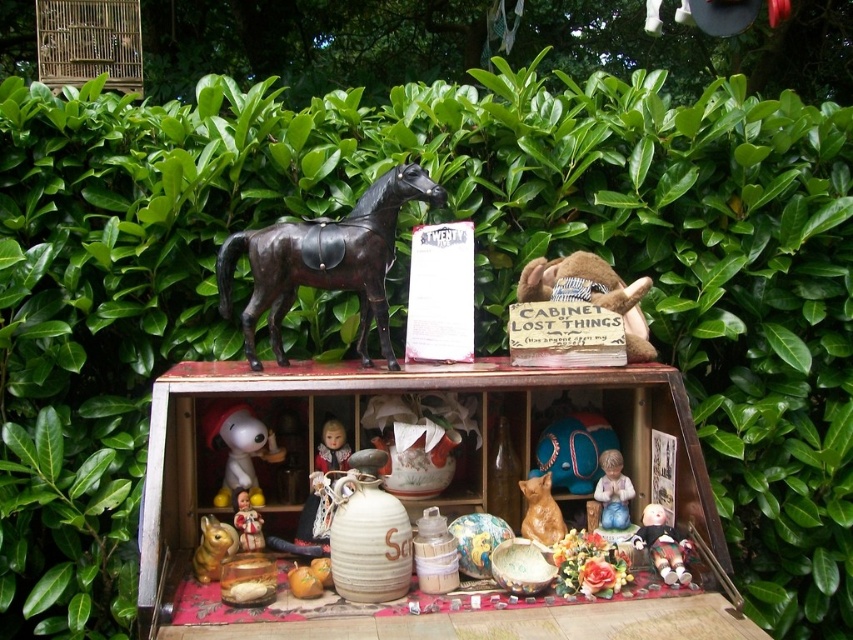
Who is higher up, brown matte cat at center or smooth wooden doll at center?

smooth wooden doll at center

Is brown matte cat at center closer to the viewer compared to smooth wooden doll at center?

Yes, brown matte cat at center is closer to the viewer.

Where is `brown matte cat at center`? Image resolution: width=853 pixels, height=640 pixels. brown matte cat at center is located at coordinates (541, 512).

Can you confirm if matte brown cat at lower left is positioned to the left of smooth wooden doll at center?

Correct, you'll find matte brown cat at lower left to the left of smooth wooden doll at center.

Does matte brown cat at lower left have a greater width compared to smooth wooden doll at center?

Yes, matte brown cat at lower left is wider than smooth wooden doll at center.

The image size is (853, 640). I want to click on matte brown cat at lower left, so click(213, 548).

Identify the location of matte brown cat at lower left. The height and width of the screenshot is (640, 853). (213, 548).

The height and width of the screenshot is (640, 853). What do you see at coordinates (325, 260) in the screenshot?
I see `shiny black horse at center` at bounding box center [325, 260].

Does point (289, 246) lie behind point (628, 483)?

No, it is in front of (628, 483).

This screenshot has height=640, width=853. Find the location of `shiny black horse at center`. shiny black horse at center is located at coordinates (325, 260).